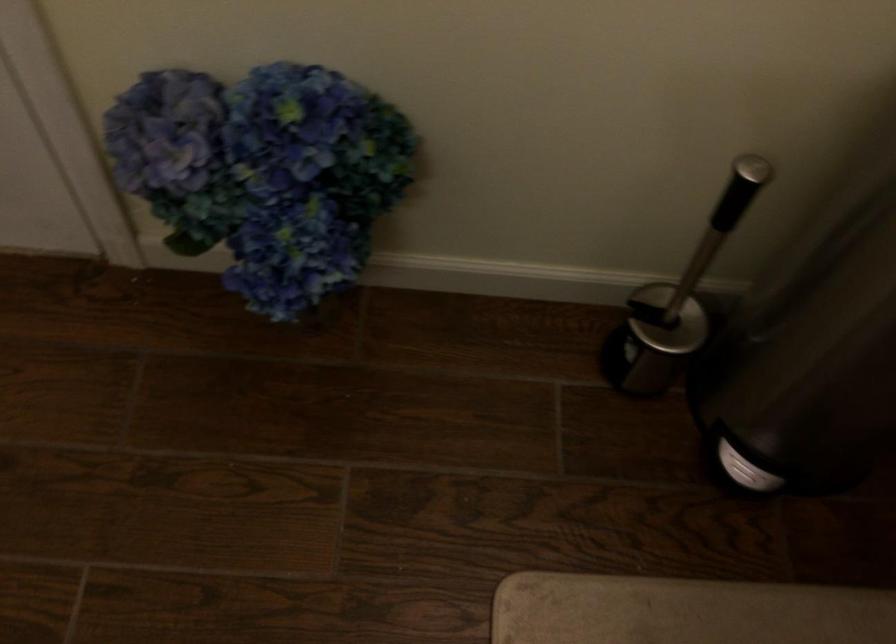
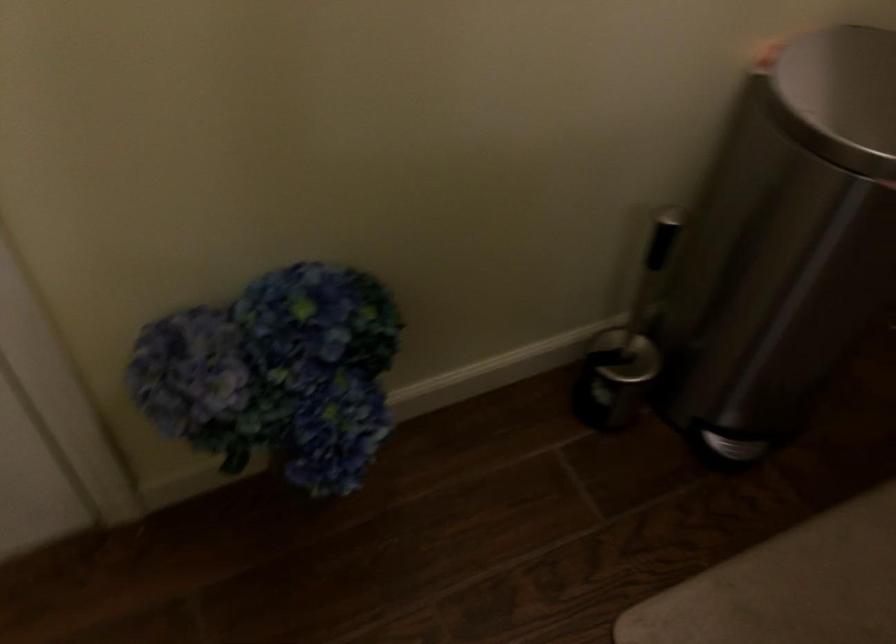
Question: The camera is either moving clockwise (left) or counter-clockwise (right) around the object. The first image is from the beginning of the video and the second image is from the end. Is the camera moving left or right when shooting the video?

Choices:
 (A) Left
 (B) Right

Answer: (A)